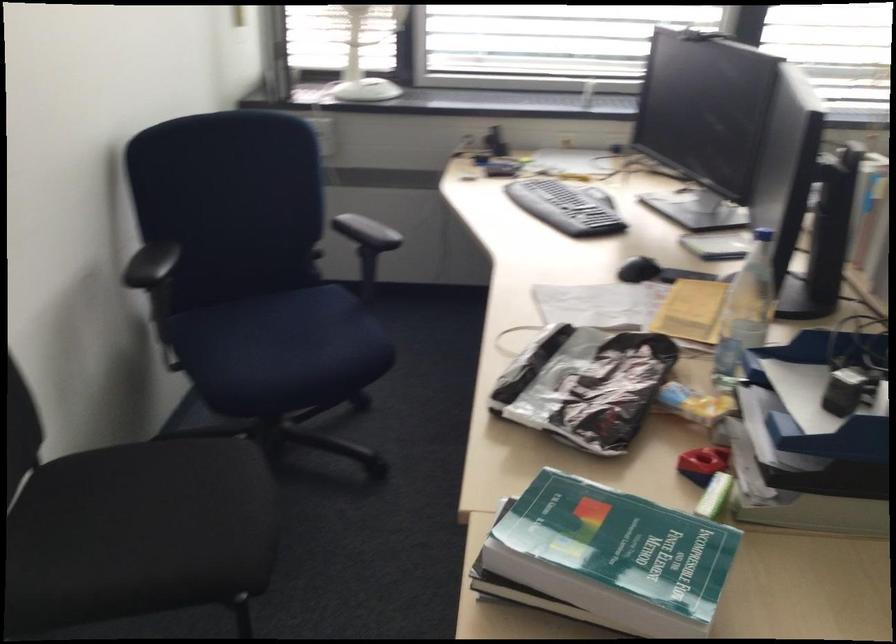
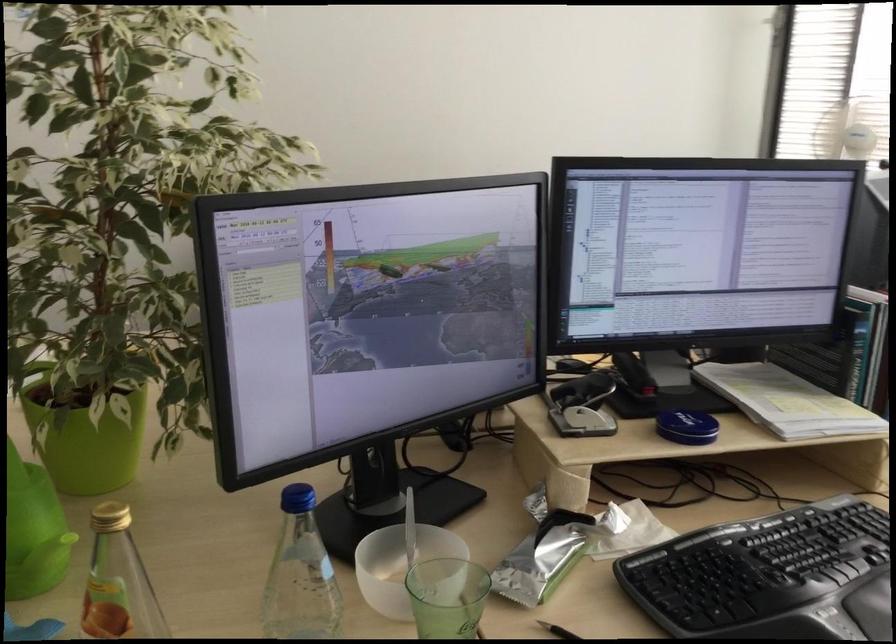
Question: I am providing you with two images of the same scene from different viewpoints. After the viewpoint changes to image2, which objects are now occluded?

Choices:
 (A) hole punch lever
 (B) green glass
 (C) black plastic knob
 (D) green hardcover book

Answer: (D)